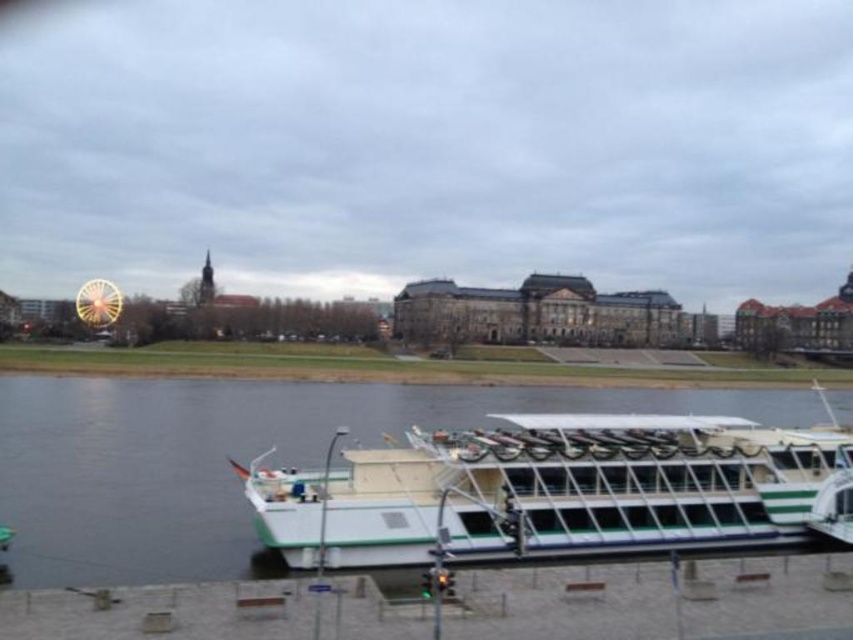
You are planning to take a photo of the white matte boat at lower center and the shiny yellow ferris wheel at left. Which object should you focus on first if you want to capture both in the same frame without moving the camera?

The white matte boat at lower center is shorter than the shiny yellow ferris wheel at left, so you should focus on the shiny yellow ferris wheel at left first to ensure it fits within the frame since it is taller.

You are standing on the riverbank and see the white matte boat at lower center and the shiny yellow ferris wheel at left. Which object is positioned more to the left?

The white matte boat at lower center is positioned more to the left than the shiny yellow ferris wheel at left.

You are planning to take a photo of the white matte boat at lower center and the shiny yellow ferris wheel at left. Since you want both objects to appear equally large in the photo, which object should you move closer to?

Since the white matte boat at lower center is narrower than the shiny yellow ferris wheel at left, you should move closer to the white matte boat at lower center to make it appear larger in the photo while keeping the ferris wheel at a distance so both objects appear equally sized.